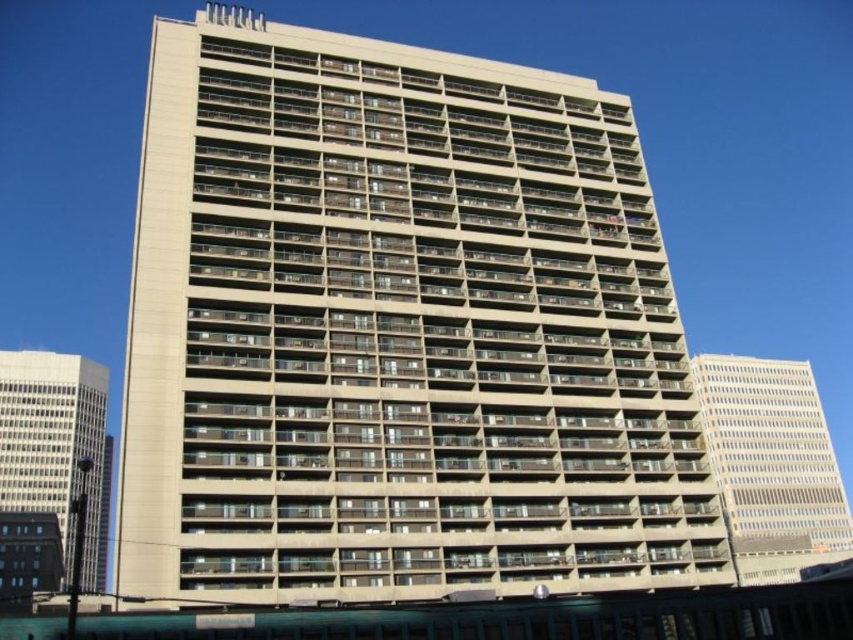
Question: Considering the real-world distances, which object is closest to the beige concrete building at center?

Choices:
 (A) beige concrete building at left
 (B) white concrete building at right

Answer: (B)

Question: Is white concrete building at right positioned in front of beige concrete building at left?

Choices:
 (A) no
 (B) yes

Answer: (B)

Question: Which point is farther from the camera taking this photo?

Choices:
 (A) (106, 483)
 (B) (730, 480)
 (C) (192, 589)

Answer: (A)

Question: Can you confirm if beige concrete building at center is positioned to the left of beige concrete building at left?

Choices:
 (A) no
 (B) yes

Answer: (A)

Question: Which of the following is the farthest from the observer?

Choices:
 (A) white concrete building at right
 (B) beige concrete building at center
 (C) beige concrete building at left

Answer: (C)

Question: Can you confirm if beige concrete building at center is positioned below beige concrete building at left?

Choices:
 (A) no
 (B) yes

Answer: (A)